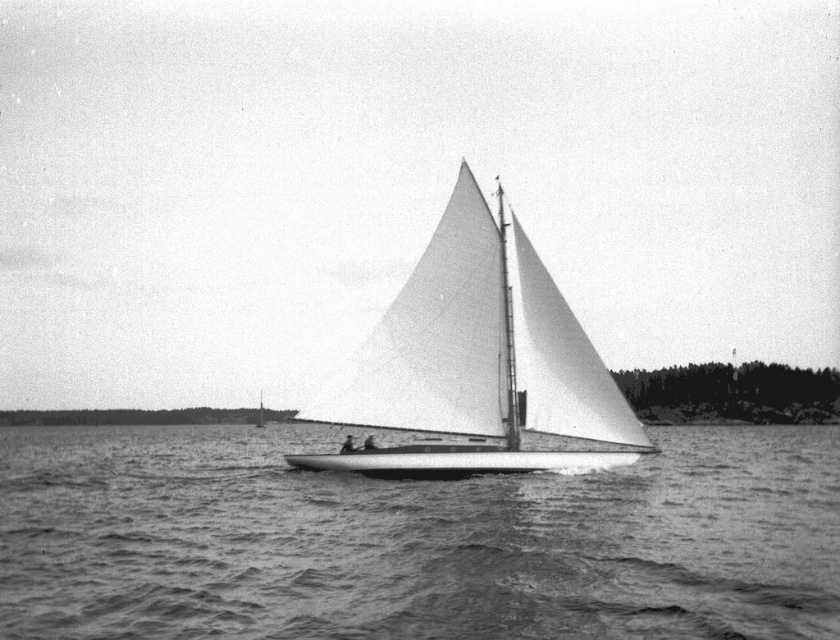
Can you confirm if smooth water at center is taller than white matte sailboat at center?

In fact, smooth water at center may be shorter than white matte sailboat at center.

Can you confirm if smooth water at center is positioned above white matte sailboat at center?

No.

Is point (150, 493) positioned after point (591, 435)?

Yes, point (150, 493) is farther from viewer.

The width and height of the screenshot is (840, 640). I want to click on smooth water at center, so click(413, 541).